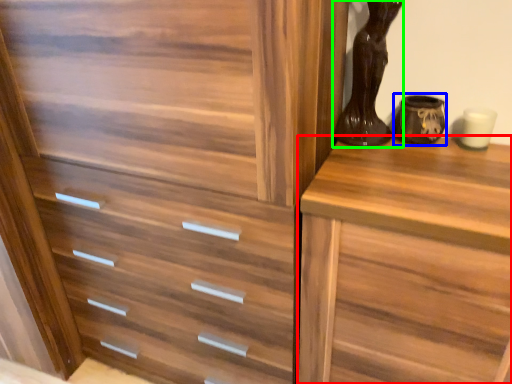
Question: Considering the real-world distances, which object is closest to chest of drawers (highlighted by a red box)? vase (highlighted by a blue box) or vase (highlighted by a green box).

Choices:
 (A) vase
 (B) vase

Answer: (B)